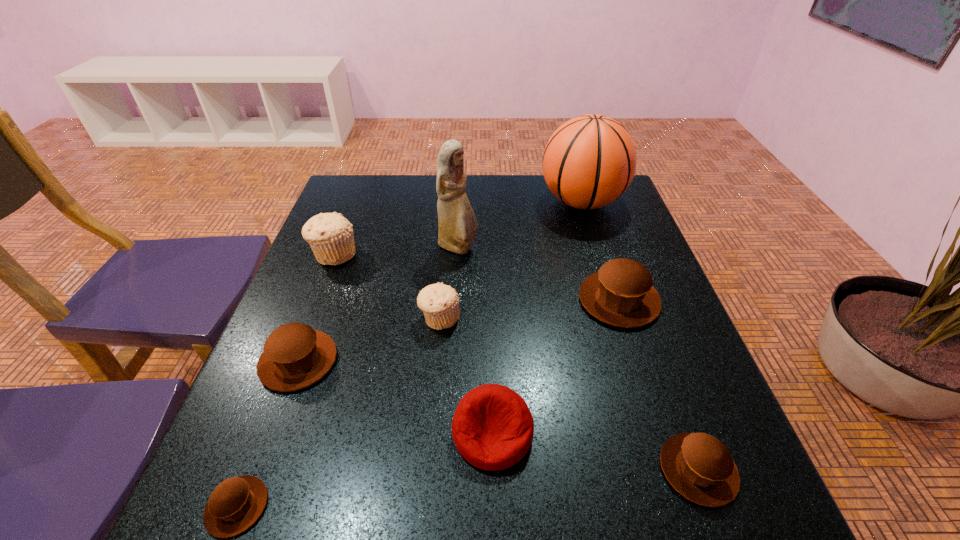
Identify the location of vacant area at the left edge of the desktop. (340, 296).

The height and width of the screenshot is (540, 960). In the image, there is a desktop. In order to click on vacant region at the right edge in this screenshot , I will do `click(681, 328)`.

Locate an element on the screen. The height and width of the screenshot is (540, 960). free space at the far left corner is located at coordinates (346, 204).

In order to click on free space between the farthest brown muffin and the smallest brown muffin in this screenshot , I will do `click(428, 403)`.

Find the location of a particular element. The image size is (960, 540). empty location between the eighth tallest object and the shortest muffin is located at coordinates (468, 488).

Image resolution: width=960 pixels, height=540 pixels. I want to click on vacant area that lies between the farthest object and the smallest brown muffin, so click(x=409, y=354).

This screenshot has width=960, height=540. Identify the location of blank region between the shortest object and the figurine. (348, 377).

I want to click on vacant point located between the second smallest brown muffin and the farther beige muffin, so click(x=516, y=362).

Where is `free point between the second farthest brown muffin and the right beige muffin`? The height and width of the screenshot is (540, 960). free point between the second farthest brown muffin and the right beige muffin is located at coordinates (370, 340).

The height and width of the screenshot is (540, 960). Find the location of `vacant area that lies between the smallest brown muffin and the figurine`. vacant area that lies between the smallest brown muffin and the figurine is located at coordinates (x=348, y=377).